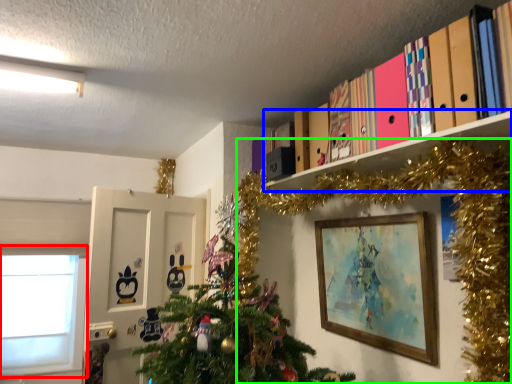
Question: Based on their relative distances, which object is nearer to window (highlighted by a red box)? Choose from shelf (highlighted by a blue box) and christmas tree (highlighted by a green box).

Choices:
 (A) shelf
 (B) christmas tree

Answer: (B)